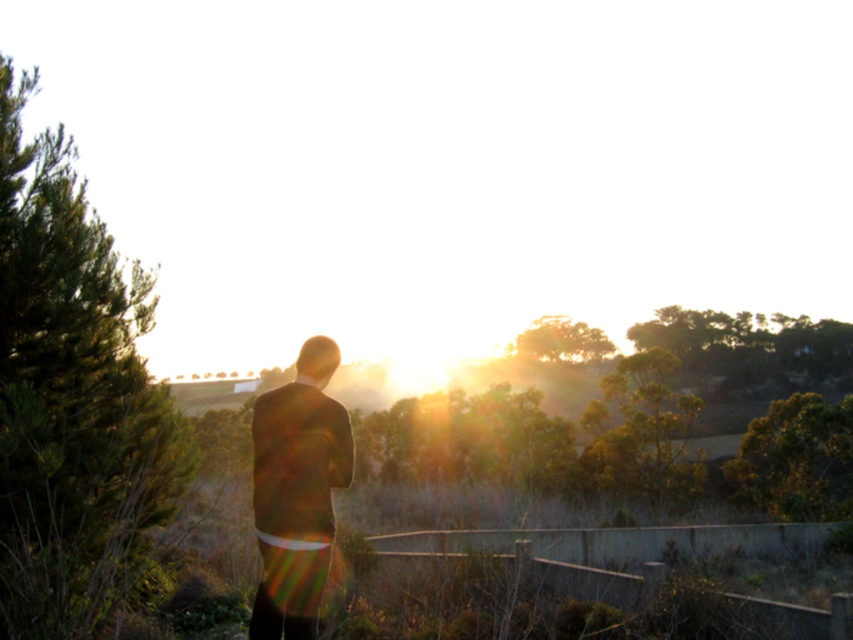
You are a photographer trying to capture a clear shot of the dark brown suit at center and the green leafy tree at center. Which object is positioned higher in the frame?

The dark brown suit at center is positioned higher than the green leafy tree at center in the frame.

You are a photographer standing at the edge of the scene, wanting to capture both the dark brown suit at center and the green leafy tree at center in the same frame. Given that your camera has a 50mm lens, which has a field of view that can capture about 45 degrees, can you fit both objects into the frame without moving your position?

The dark brown suit at center and green leafy tree at center are 75.10 feet apart. With a 50mm lens providing a 45 degree field of view, the maximum distance between two objects that can be captured in the same frame would depend on the camera sensor size and distance from the subject. However, since the objects are positioned at the center and the scene is relatively open, it is likely possible to adjust the framing to include both within the 45 degree angle.

You are a hiker who wants to take a photo of the green leafy tree at left and the green leafy tree at center with the sun in the background. Which tree should you stand closer to in order to include both trees and the sun in your photo frame?

You should stand closer to the green leafy tree at left because it is shorter than the green leafy tree at center, allowing you to frame both trees and the sun together in the photo.